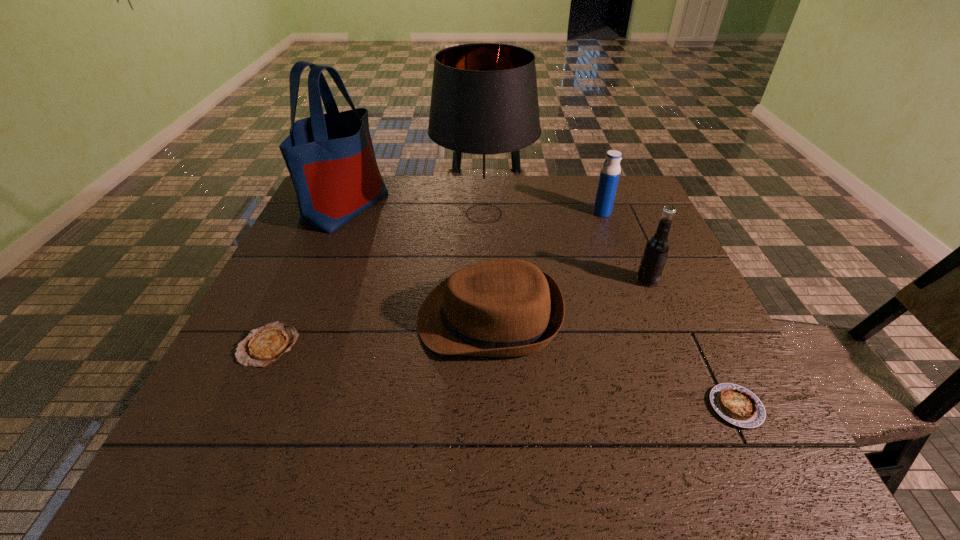
At what (x,y) coordinates should I click in order to perform the action: click on vacant region at the far edge. Please return your answer as a coordinate pair (x, y). This screenshot has height=540, width=960. Looking at the image, I should click on (432, 179).

Where is `free space at the near edge`? The height and width of the screenshot is (540, 960). free space at the near edge is located at coordinates (330, 470).

I want to click on free space at the left edge, so click(x=352, y=227).

In the image, there is a desktop. Where is `vacant space at the right edge`? vacant space at the right edge is located at coordinates (665, 293).

This screenshot has width=960, height=540. I want to click on vacant space at the near left corner of the desktop, so click(x=174, y=456).

At what (x,y) coordinates should I click in order to perform the action: click on vacant region at the near right corner of the desktop. Please return your answer as a coordinate pair (x, y). Image resolution: width=960 pixels, height=540 pixels. Looking at the image, I should click on (784, 459).

The image size is (960, 540). I want to click on free space between the root beer and the lampshade, so click(565, 247).

Identify the location of vacant space that's between the handbag and the root beer. This screenshot has height=540, width=960. (496, 244).

Identify the location of empty location between the lampshade and the left quiche. (376, 279).

Image resolution: width=960 pixels, height=540 pixels. What are the coordinates of `free space between the root beer and the handbag` in the screenshot? It's located at (496, 244).